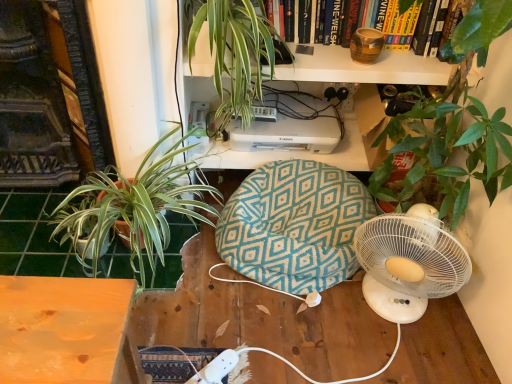
Question: Is teal fabric bean bag at center looking in the opposite direction of brown textured vase at upper center?

Choices:
 (A) yes
 (B) no

Answer: (B)

Question: Does teal fabric bean bag at center have a greater width compared to brown textured vase at upper center?

Choices:
 (A) no
 (B) yes

Answer: (B)

Question: From a real-world perspective, is teal fabric bean bag at center located higher than brown textured vase at upper center?

Choices:
 (A) no
 (B) yes

Answer: (A)

Question: Does teal fabric bean bag at center lie behind brown textured vase at upper center?

Choices:
 (A) no
 (B) yes

Answer: (A)

Question: Considering the relative sizes of teal fabric bean bag at center and brown textured vase at upper center in the image provided, is teal fabric bean bag at center taller than brown textured vase at upper center?

Choices:
 (A) yes
 (B) no

Answer: (A)

Question: Is teal fabric bean bag at center smaller than brown textured vase at upper center?

Choices:
 (A) no
 (B) yes

Answer: (A)

Question: Is teal fabric bean bag at center wider than green leafy plant at left, the 1th houseplant from the bottom?

Choices:
 (A) no
 (B) yes

Answer: (A)

Question: Is green leafy plant at left, arranged as the 2th houseplant when viewed from the top, at the back of teal fabric bean bag at center?

Choices:
 (A) yes
 (B) no

Answer: (B)

Question: Is teal fabric bean bag at center smaller than green leafy plant at left, the 1th houseplant from the bottom?

Choices:
 (A) yes
 (B) no

Answer: (A)

Question: From the image's perspective, is teal fabric bean bag at center located above green leafy plant at left, the 1th houseplant from the bottom?

Choices:
 (A) no
 (B) yes

Answer: (A)

Question: Is teal fabric bean bag at center positioned beyond the bounds of green leafy plant at left, arranged as the 2th houseplant when viewed from the top?

Choices:
 (A) no
 (B) yes

Answer: (B)

Question: Does teal fabric bean bag at center have a larger size compared to green leafy plant at left, the 1th houseplant from the bottom?

Choices:
 (A) no
 (B) yes

Answer: (A)

Question: Is teal fabric bean bag at center thinner than green leafy plant at upper center, which is counted as the first houseplant, starting from the top?

Choices:
 (A) no
 (B) yes

Answer: (B)